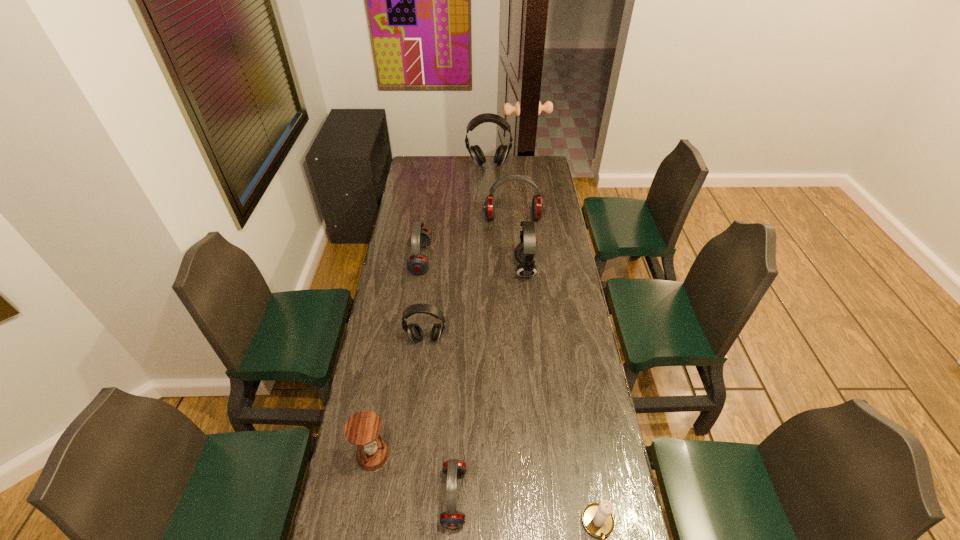
Locate which red earphone is the closest to the white candle holder. Please provide its 2D coordinates. Your answer should be formatted as a tuple, i.e. [(x, y)], where the tuple contains the x and y coordinates of a point satisfying the conditions above.

[(451, 518)]

At what (x,y) coordinates should I click in order to perform the action: click on the second closest red earphone to the smallest black earphone. Please return your answer as a coordinate pair (x, y). Looking at the image, I should click on (451, 518).